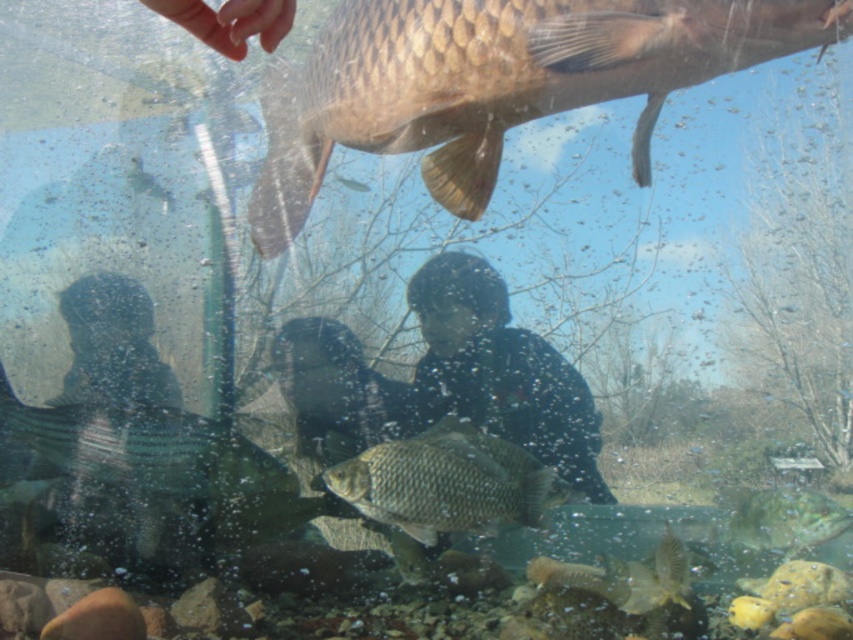
You are a snorkeler swimming in the water and see the shiny silver fish at center and the black matte person at lower left. How far apart are these two objects from each other?

The shiny silver fish at center is 19.37 inches away from the black matte person at lower left.

You are a marine biologist observing the underwater scene. You notice the shiny silver fish at center and the black matte person at lower left. Which object has a greater width?

The shiny silver fish at center has a greater width than the black matte person at lower left.